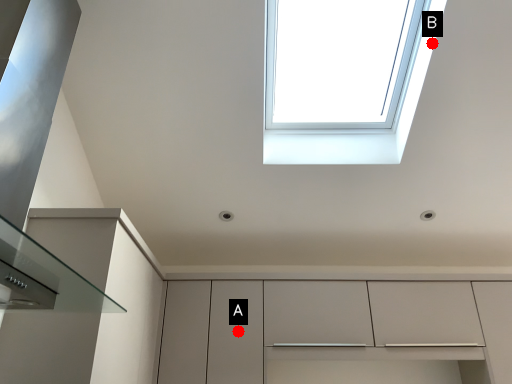
Question: Two points are circled on the image, labeled by A and B beside each circle. Which point is closer to the camera?

Choices:
 (A) A is closer
 (B) B is closer

Answer: (B)